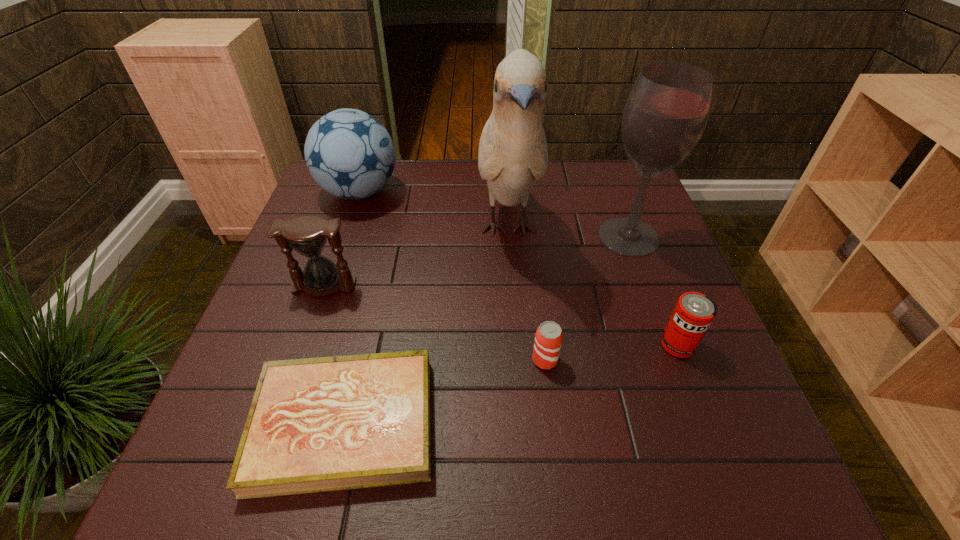
Where is `vacant space that's between the parakeet and the fifth shortest object`? This screenshot has width=960, height=540. vacant space that's between the parakeet and the fifth shortest object is located at coordinates (434, 211).

Find the location of a particular element. The height and width of the screenshot is (540, 960). empty space that is in between the hourglass and the shortest object is located at coordinates (334, 354).

At what (x,y) coordinates should I click in order to perform the action: click on blank region between the hourglass and the third shortest object. Please return your answer as a coordinate pair (x, y). Looking at the image, I should click on (501, 315).

Where is `empty space between the hardback book and the parakeet`? This screenshot has height=540, width=960. empty space between the hardback book and the parakeet is located at coordinates (426, 326).

Where is `unoccupied position between the shortest object and the alcohol`? Image resolution: width=960 pixels, height=540 pixels. unoccupied position between the shortest object and the alcohol is located at coordinates (487, 330).

Where is `blank region between the hourglass and the third shortest object`? The width and height of the screenshot is (960, 540). blank region between the hourglass and the third shortest object is located at coordinates (501, 315).

At what (x,y) coordinates should I click in order to perform the action: click on free area in between the hourglass and the fifth tallest object. Please return your answer as a coordinate pair (x, y). The height and width of the screenshot is (540, 960). Looking at the image, I should click on (501, 315).

The width and height of the screenshot is (960, 540). Find the location of `vacant point located between the beer can and the fifth shortest object`. vacant point located between the beer can and the fifth shortest object is located at coordinates (452, 276).

Identify the location of vacant region between the fifth tallest object and the parakeet. (592, 287).

I want to click on vacant point located between the beer can and the second tallest object, so click(587, 299).